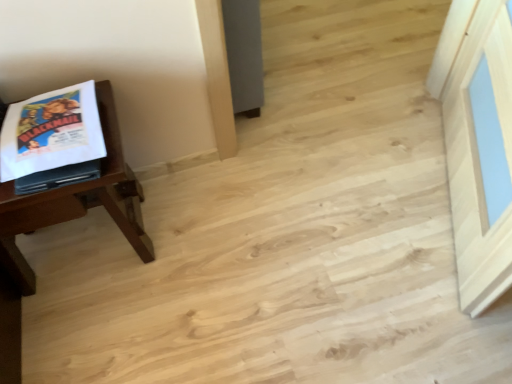
I want to click on free space on the front side of wooden table at left, so click(102, 328).